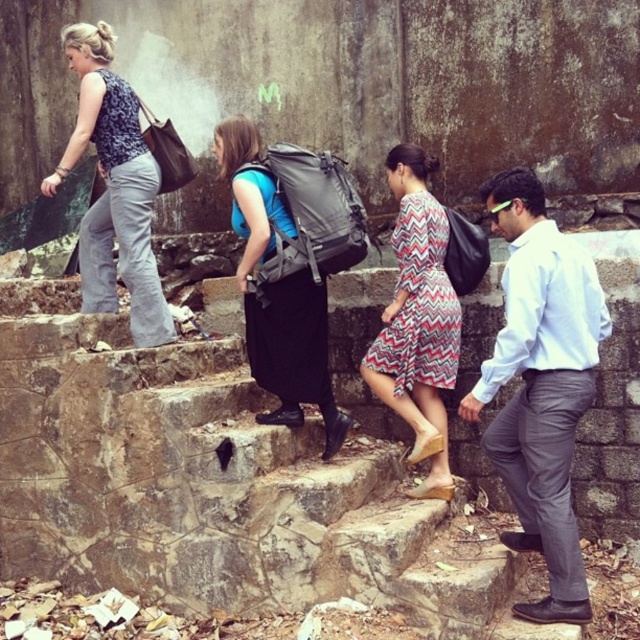
Who is more forward, (344, 572) or (134, 278)?

Point (344, 572)

In the scene shown: Does stone stairs at center appear under matte black top at left?

Yes, stone stairs at center is below matte black top at left.

Between point (232, 586) and point (145, 332), which one is positioned in front?

Point (232, 586)

Identify the location of stone stairs at center. (218, 486).

Who is positioned more to the right, chevron-patterned fabric dress at center or black cotton dress at center?

Positioned to the right is chevron-patterned fabric dress at center.

Is point (444, 232) positioned after point (276, 365)?

Yes, it is behind point (276, 365).

Does point (406, 384) come behind point (272, 317)?

Yes, point (406, 384) is behind point (272, 317).

This screenshot has height=640, width=640. Identify the location of chevron-patterned fabric dress at center. (419, 301).

Is matte gray backpack at center bigger than black cotton dress at center?

Yes.

Who is shorter, matte gray backpack at center or black cotton dress at center?

With less height is black cotton dress at center.

Between point (296, 284) and point (298, 365), which one is positioned in front?

Point (296, 284)

Locate an element on the screen. The image size is (640, 640). matte gray backpack at center is located at coordinates (276, 292).